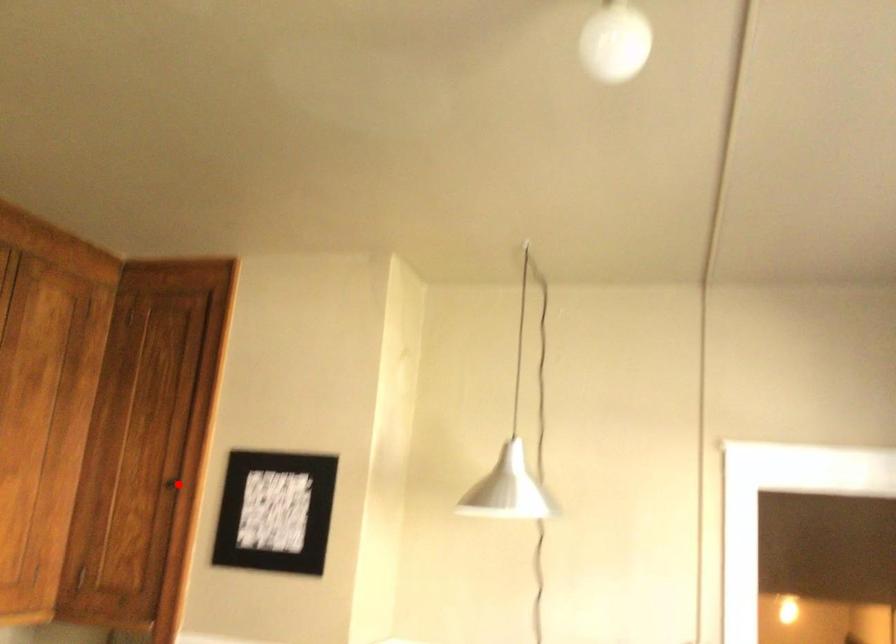
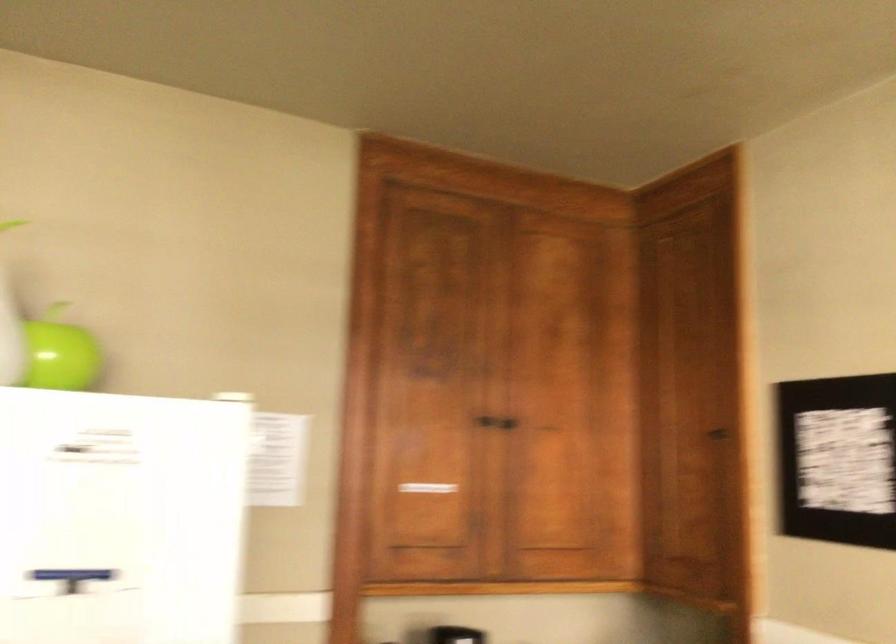
The point at the highlighted location is marked in the first image. Where is the corresponding point in the second image?

(719, 436)